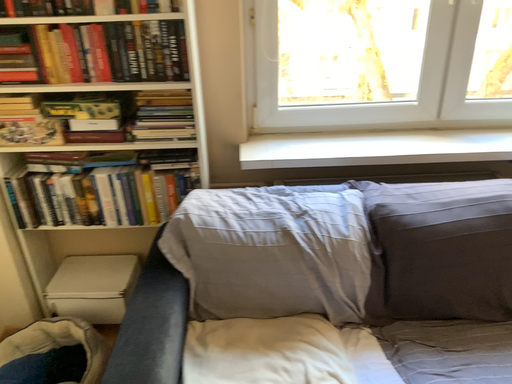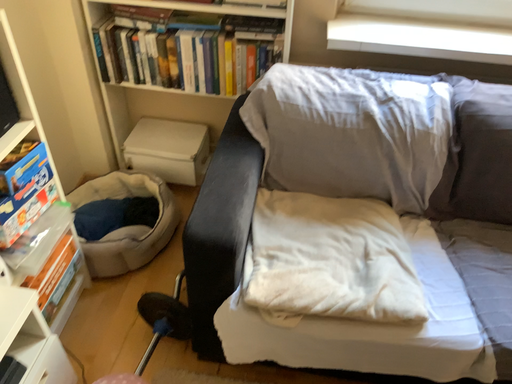
Question: Which way did the camera rotate in the video?

Choices:
 (A) rotated right
 (B) rotated left

Answer: (B)